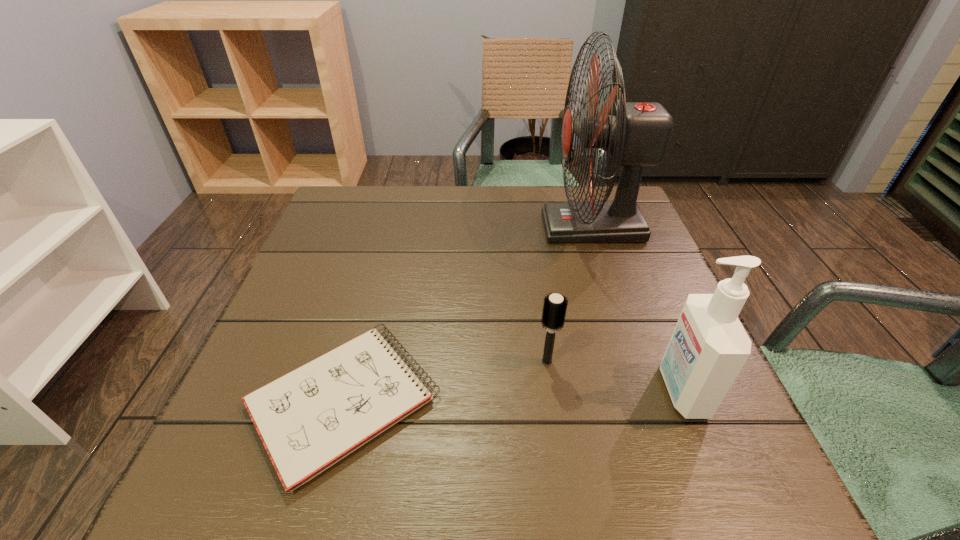
The image size is (960, 540). I want to click on the farthest object, so click(636, 134).

Where is `the tallest object`? the tallest object is located at coordinates point(636,134).

Where is `cleansing agent`? The image size is (960, 540). cleansing agent is located at coordinates (709, 346).

Image resolution: width=960 pixels, height=540 pixels. What are the coordinates of `the third object from right to left` in the screenshot? It's located at (554, 308).

Where is `the third tallest object`? the third tallest object is located at coordinates (554, 308).

Find the location of `notepad`. notepad is located at coordinates (309, 419).

Where is `the leftmost object`? The height and width of the screenshot is (540, 960). the leftmost object is located at coordinates (309, 419).

Find the location of a particular element. The height and width of the screenshot is (540, 960). free region located on the front-facing side of the farthest object is located at coordinates [419, 227].

This screenshot has width=960, height=540. I want to click on blank space located on the front-facing side of the farthest object, so click(x=403, y=227).

You are a GUI agent. You are given a task and a screenshot of the screen. Output one action in this format:
    pyautogui.click(x=<x>, y=<y>)
    Task: Click on the vacant space located on the front-facing side of the farthest object
    The width and height of the screenshot is (960, 540).
    Given the screenshot: What is the action you would take?
    pyautogui.click(x=477, y=227)